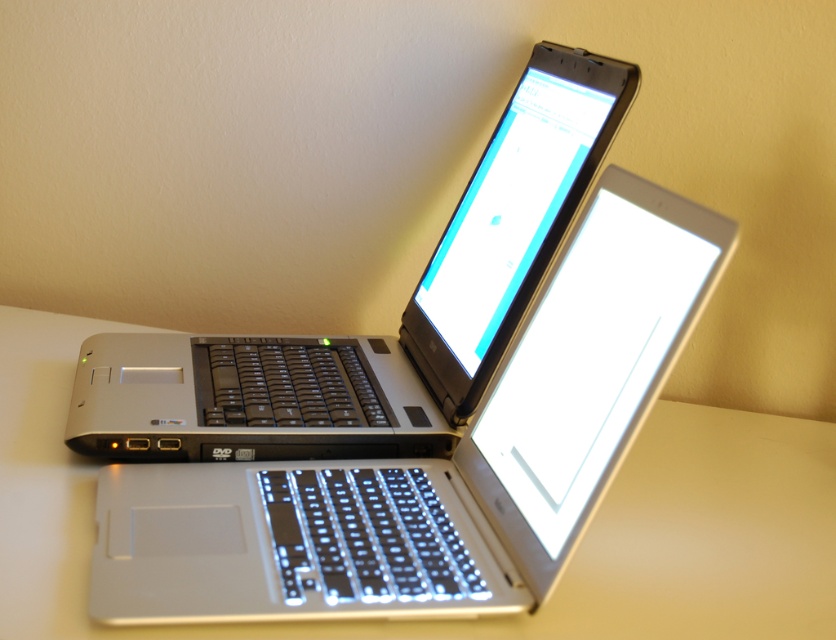
Question: Does white matte table at center lie in front of satin silver laptop at center?

Choices:
 (A) yes
 (B) no

Answer: (A)

Question: Which object is closer to the camera taking this photo?

Choices:
 (A) white matte table at center
 (B) satin silver laptop at center

Answer: (A)

Question: Does white matte table at center have a greater width compared to satin silver laptop at center?

Choices:
 (A) no
 (B) yes

Answer: (B)

Question: Does white matte table at center lie in front of satin silver laptop at center?

Choices:
 (A) yes
 (B) no

Answer: (A)

Question: Which object appears farthest from the camera in this image?

Choices:
 (A) white matte table at center
 (B) satin silver laptop at center

Answer: (B)